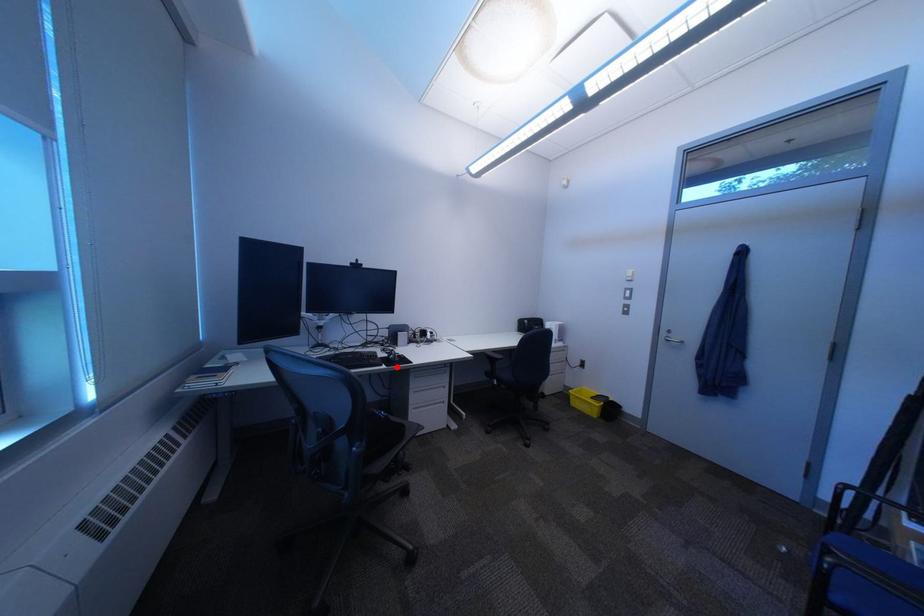
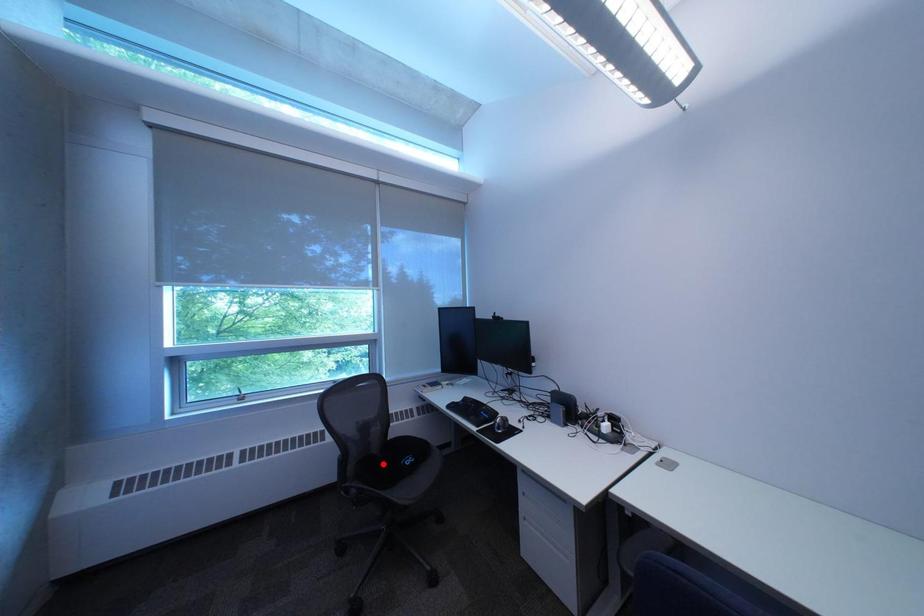
I am providing you with two images of the same scene from different viewpoints. A red point is marked on the first image and another point is marked on the second image. Is the marked point in image1 the same physical position as the marked point in image2?

No